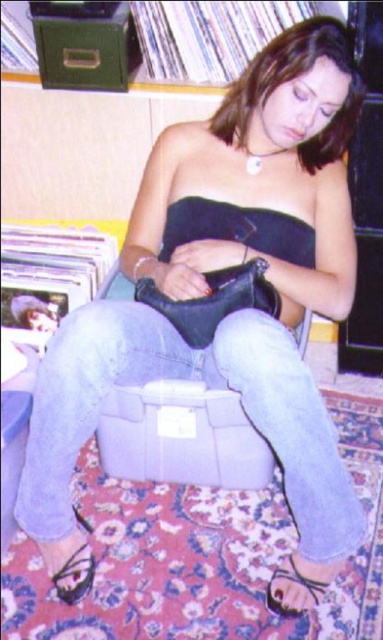
You are a fashion designer trying to create a new collection. You observe the denim jeans at center and the black leather sandal at lower left in the image. Which item has a greater width?

The denim jeans at center has a greater width than the black leather sandal at lower left according to the description.

You are a photographer setting up a shoot in the room. You need to position a small prop between the denim jeans at center and the black leather sandal at lower left. Based on their positions, where should you place the prop to ensure it is between them?

The denim jeans at center is positioned on the right side of black leather sandal at lower left, so place the prop to the right of the black leather sandal at lower left but left of the denim jeans at center to position it between them.